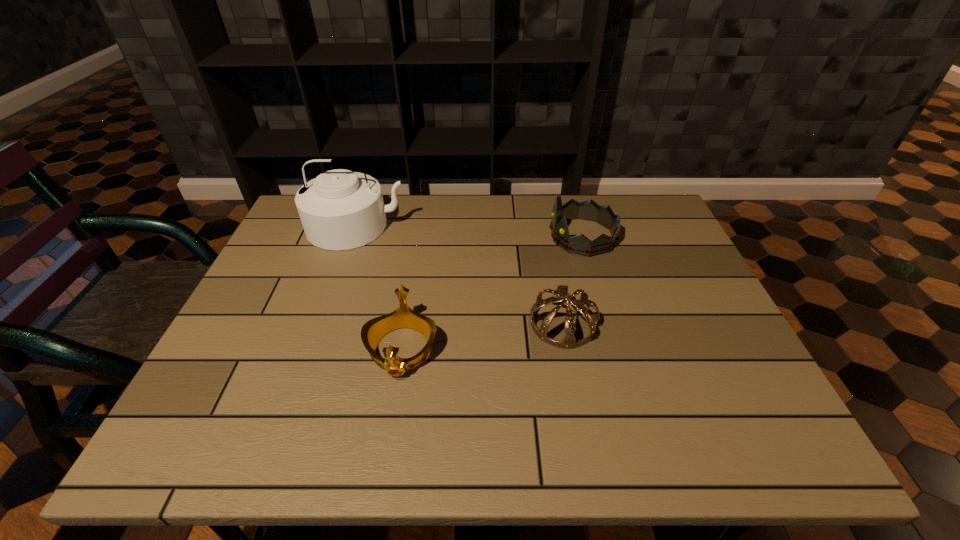
Identify the location of kettle. The width and height of the screenshot is (960, 540). (339, 209).

Identify the location of the tallest tiara. (589, 210).

Where is `the farthest tiara`? The width and height of the screenshot is (960, 540). the farthest tiara is located at coordinates (589, 210).

The width and height of the screenshot is (960, 540). What are the coordinates of `the leftmost tiara` in the screenshot? It's located at (372, 331).

Image resolution: width=960 pixels, height=540 pixels. I want to click on free point located 0.100m on the spout of the kettle, so click(340, 275).

This screenshot has width=960, height=540. Find the location of `blank area located at the front of the third shortest object with jewels`. blank area located at the front of the third shortest object with jewels is located at coordinates pyautogui.click(x=525, y=237).

I want to click on free space located 0.310m at the front of the third shortest object with jewels, so click(x=443, y=237).

Identify the location of vacant region located at the front of the third shortest object with jewels. The width and height of the screenshot is (960, 540). (484, 237).

Find the location of `free location located at the front emblem of the leftmost tiara`. free location located at the front emblem of the leftmost tiara is located at coordinates (392, 413).

Find the location of `kettle that is at the far edge`. kettle that is at the far edge is located at coordinates [x=339, y=209].